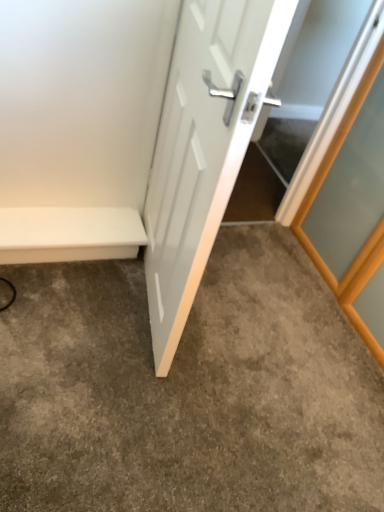
Locate an element on the screen. free location in front of white matte bench at lower left is located at coordinates (57, 312).